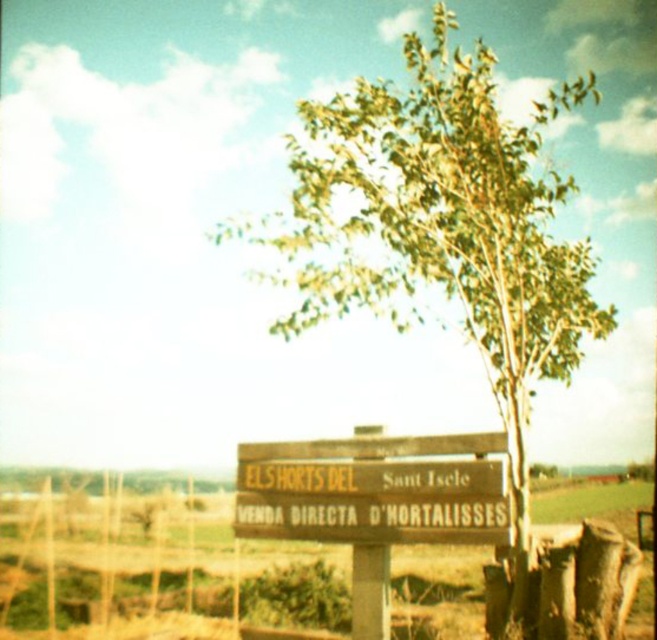
Question: Which of the following is the farthest from the observer?

Choices:
 (A) brown wooden signpost at center
 (B) green leafy tree at center
 (C) wooden sign at center

Answer: (A)

Question: Does green leafy tree at center appear under wooden sign at center?

Choices:
 (A) no
 (B) yes

Answer: (A)

Question: Can you confirm if green leafy tree at center is positioned above wooden sign at center?

Choices:
 (A) no
 (B) yes

Answer: (B)

Question: Is green leafy tree at center smaller than wooden sign at center?

Choices:
 (A) yes
 (B) no

Answer: (B)

Question: Among these points, which one is farthest from the camera?

Choices:
 (A) (484, 452)
 (B) (509, 248)

Answer: (B)

Question: Which point appears closest to the camera in this image?

Choices:
 (A) (83, 582)
 (B) (306, 189)
 (C) (351, 502)

Answer: (C)